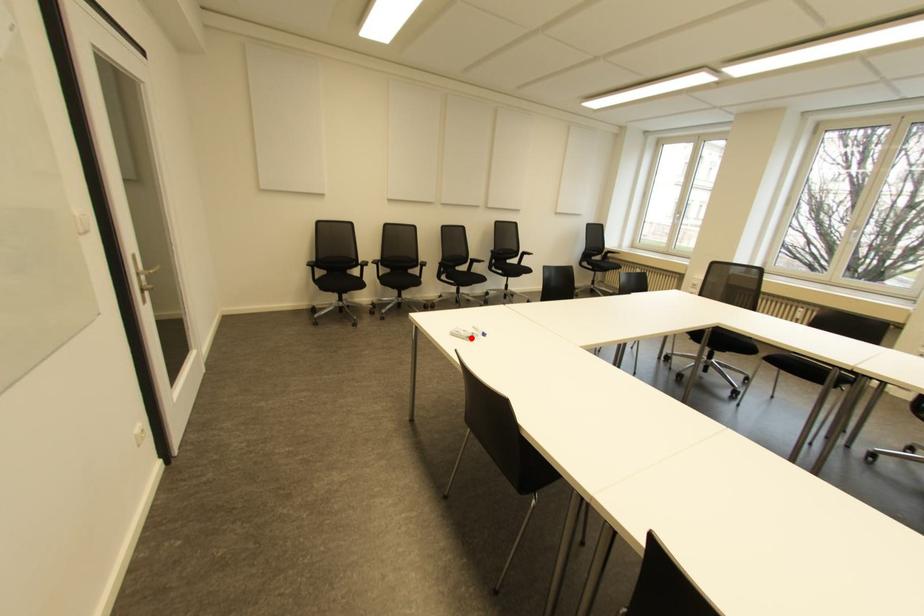
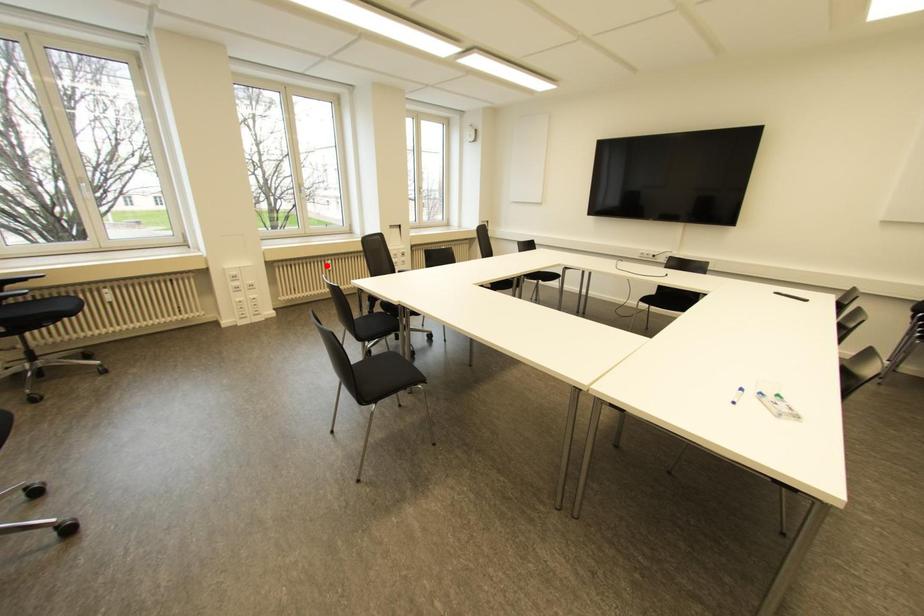
Consider the image. I am providing you with two images of the same scene from different viewpoints. A red point is marked on the first image and another point is marked on the second image. Are the points marked in image1 and image2 representing the same 3D position?

No